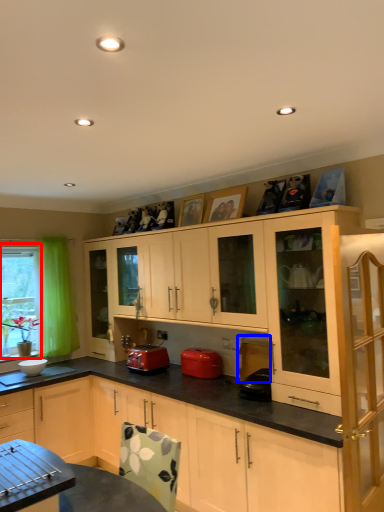
Question: Which object is closer to the camera taking this photo, bay window (highlighted by a red box) or appliance (highlighted by a blue box)?

Choices:
 (A) bay window
 (B) appliance

Answer: (B)